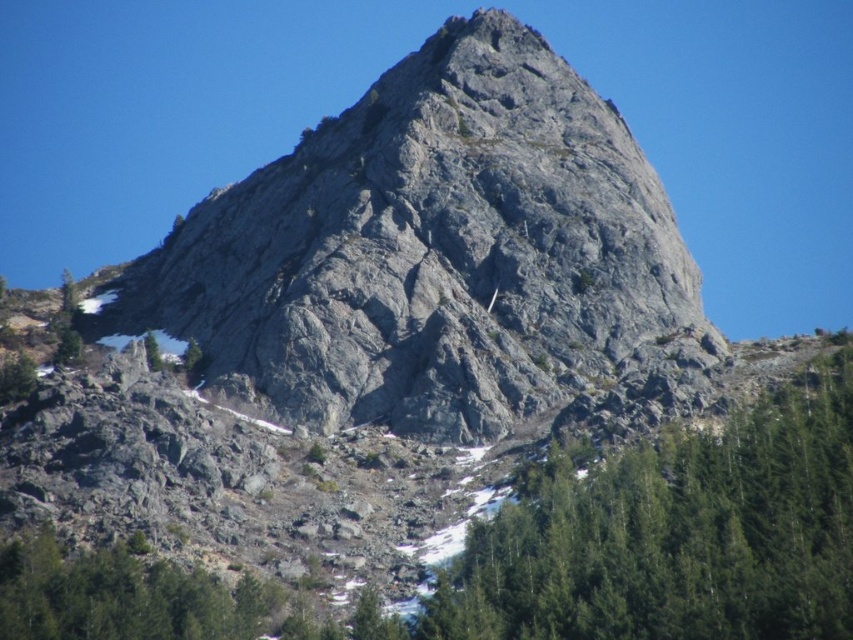
Question: In this image, where is gray rocky mountain at center located relative to green matte tree at lower left?

Choices:
 (A) left
 (B) right

Answer: (B)

Question: Which point is closer to the camera?

Choices:
 (A) green textured tree at center
 (B) gray rocky mountain at center

Answer: (A)

Question: Is the position of gray rocky mountain at center less distant than that of green textured tree at center?

Choices:
 (A) no
 (B) yes

Answer: (A)

Question: Which object appears farthest from the camera in this image?

Choices:
 (A) green textured tree at center
 (B) gray rocky mountain at center
 (C) green matte tree at lower left

Answer: (C)

Question: Which point is farther to the camera?

Choices:
 (A) (788, 483)
 (B) (144, 348)

Answer: (B)

Question: Is green textured tree at center wider than green matte tree at lower left?

Choices:
 (A) no
 (B) yes

Answer: (B)